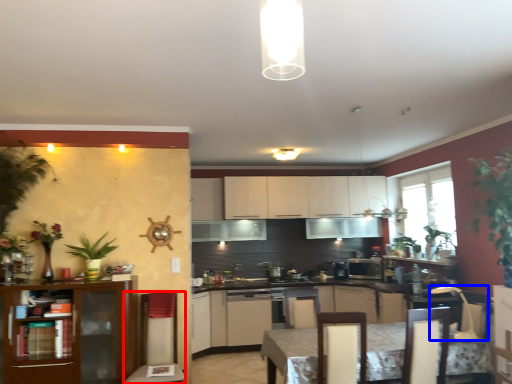
Question: Which object appears closest to the camera in this image, swivel chair (highlighted by a red box) or swivel chair (highlighted by a blue box)?

Choices:
 (A) swivel chair
 (B) swivel chair

Answer: (B)